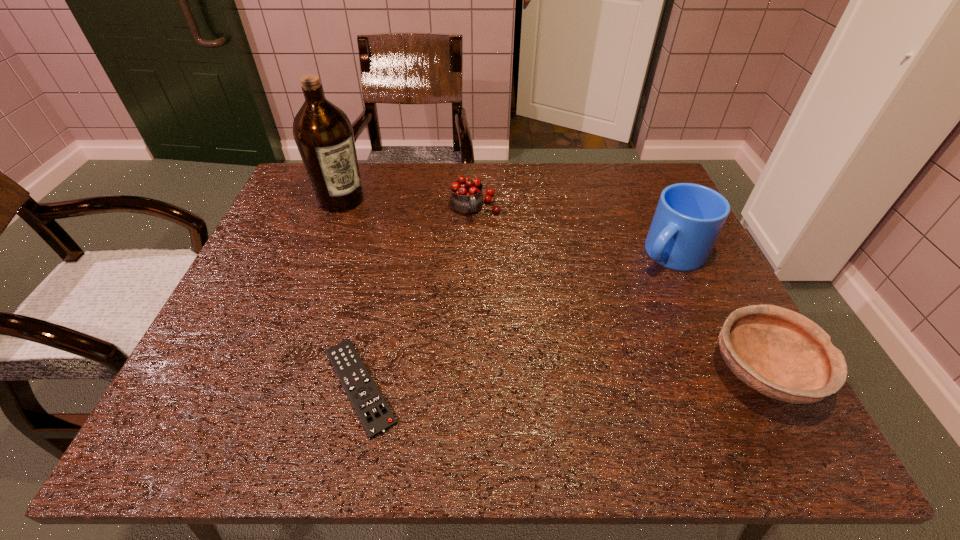
Where is `remote control that is at the near edge`? The height and width of the screenshot is (540, 960). remote control that is at the near edge is located at coordinates (375, 415).

Locate an element on the screen. The height and width of the screenshot is (540, 960). bowl at the near edge is located at coordinates (780, 353).

Identify the location of object that is at the left edge. (323, 133).

In order to click on bowl present at the right edge in this screenshot , I will do `click(780, 353)`.

Where is `mug present at the right edge`? The height and width of the screenshot is (540, 960). mug present at the right edge is located at coordinates (688, 219).

The image size is (960, 540). I want to click on object at the far left corner, so click(323, 133).

This screenshot has width=960, height=540. I want to click on object located at the near right corner, so click(780, 353).

In the image, there is a desktop. What are the coordinates of `vacant space at the far edge` in the screenshot? It's located at (359, 163).

Find the location of a particular element. This screenshot has width=960, height=540. free region at the near edge of the desktop is located at coordinates (486, 361).

This screenshot has height=540, width=960. In the image, there is a desktop. In order to click on vacant space at the left edge in this screenshot , I will do `click(271, 238)`.